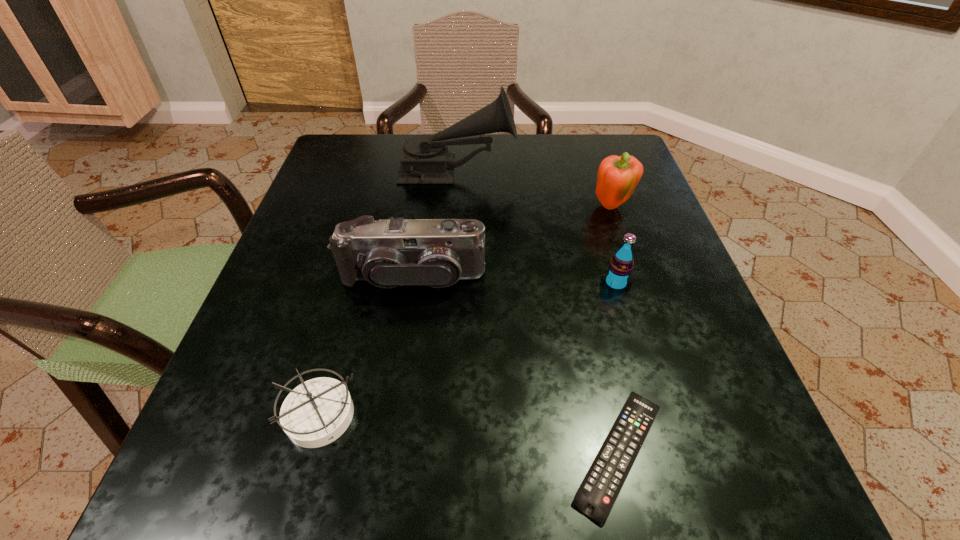
Identify the location of remote control present at the right edge. (596, 495).

Find the location of a particular element. Image resolution: width=960 pixels, height=540 pixels. object positioned at the near left corner is located at coordinates (317, 412).

The height and width of the screenshot is (540, 960). In order to click on object positioned at the near right corner in this screenshot , I will do `click(596, 495)`.

Image resolution: width=960 pixels, height=540 pixels. In order to click on vacant area at the far edge of the desktop in this screenshot , I will do `click(566, 186)`.

This screenshot has height=540, width=960. In the image, there is a desktop. In order to click on vacant space at the near edge in this screenshot , I will do `click(573, 485)`.

This screenshot has width=960, height=540. In the image, there is a desktop. In order to click on vacant space at the left edge in this screenshot , I will do `click(334, 225)`.

This screenshot has height=540, width=960. What are the coordinates of `vacant space at the right edge` in the screenshot? It's located at (704, 316).

Find the location of a particular element. vacant area at the far left corner of the desktop is located at coordinates (356, 159).

In order to click on free space at the near right corner in this screenshot , I will do `click(712, 457)`.

Find the location of a particular element. unoccupied position between the second farthest object and the shortest object is located at coordinates (615, 330).